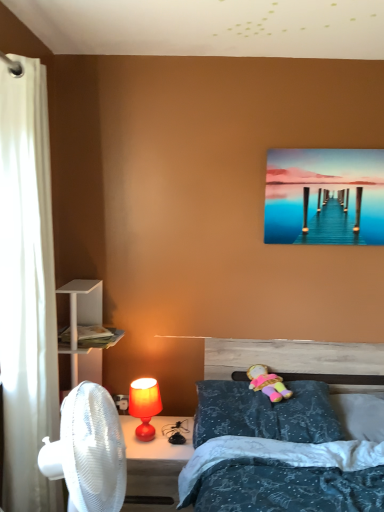
The image size is (384, 512). What do you see at coordinates (154, 463) in the screenshot? I see `matte red lamp at lower center` at bounding box center [154, 463].

Image resolution: width=384 pixels, height=512 pixels. What do you see at coordinates (144, 405) in the screenshot?
I see `matte orange lamp at lower left` at bounding box center [144, 405].

You are a GUI agent. You are given a task and a screenshot of the screen. Output one action in this format:
    pyautogui.click(x=<x>, y=<y>)
    Task: Click on the metallic glossy pier at upper right
    The image size is (384, 512).
    Given the screenshot: What is the action you would take?
    pyautogui.click(x=324, y=196)

Locate an element on the screen. The image size is (384, 512). blue textured pillow at lower right, which appears as the second pillow when viewed from the left is located at coordinates (360, 415).

Considering the relative positions of white fabric curtain at left and blue textured pillow at center, which is the second pillow from right to left, in the image provided, is white fabric curtain at left in front of blue textured pillow at center, which is the second pillow from right to left,?

Yes, white fabric curtain at left is in front of blue textured pillow at center, which is the second pillow from right to left.

Which point is more forward, [53,347] or [332,435]?

The point [53,347] is closer to the camera.

Is white fabric curtain at left thinner than blue textured pillow at center, which is the second pillow from right to left?

Indeed, white fabric curtain at left has a lesser width compared to blue textured pillow at center, which is the second pillow from right to left.

From the image's perspective, is white fabric curtain at left located above or below blue textured pillow at center, the 1th pillow in the left-to-right sequence?

white fabric curtain at left is above blue textured pillow at center, the 1th pillow in the left-to-right sequence.

Find the location of a particular element. This screenshot has height=512, width=384. lamp behind the matte red lamp at lower center is located at coordinates (144, 405).

In the image, is matte orange lamp at lower left on the left side or the right side of matte red lamp at lower center?

In the image, matte orange lamp at lower left appears on the left side of matte red lamp at lower center.

Is matte orange lamp at lower left not within matte red lamp at lower center?

Indeed, matte orange lamp at lower left is completely outside matte red lamp at lower center.

Does matte orange lamp at lower left have a larger size compared to matte red lamp at lower center?

No, matte orange lamp at lower left is not bigger than matte red lamp at lower center.

Is white fabric curtain at left placed right next to matte red lamp at lower center?

No, white fabric curtain at left is not next to matte red lamp at lower center.

Looking at this image, which of these two, white fabric curtain at left or matte red lamp at lower center, stands taller?

white fabric curtain at left.

Is white fabric curtain at left aimed at matte red lamp at lower center?

No, white fabric curtain at left is not aimed at matte red lamp at lower center.

Locate an element on the screen. The width and height of the screenshot is (384, 512). desk below the white fabric curtain at left (from a real-world perspective) is located at coordinates (154, 463).

How many degrees apart are the facing directions of white fabric curtain at left and matte orange lamp at lower left?

89.1 degrees separate the facing orientations of white fabric curtain at left and matte orange lamp at lower left.

Is white fabric curtain at left located outside matte orange lamp at lower left?

white fabric curtain at left is positioned outside matte orange lamp at lower left.

In the scene shown: Is white fabric curtain at left oriented towards matte orange lamp at lower left?

No, white fabric curtain at left is not turned towards matte orange lamp at lower left.

In the image, is white fabric curtain at left on the left side or the right side of matte orange lamp at lower left?

From the image, it's evident that white fabric curtain at left is to the left of matte orange lamp at lower left.

Is the surface of white fabric curtain at left in direct contact with blue textured pillow at lower right, which appears as the second pillow when viewed from the left?

white fabric curtain at left and blue textured pillow at lower right, which appears as the second pillow when viewed from the left, are not in contact.

Can you confirm if white fabric curtain at left is taller than blue textured pillow at lower right, which appears as the second pillow when viewed from the left?

Yes.

Considering the relative positions of white fabric curtain at left and blue textured pillow at lower right, which appears as the second pillow when viewed from the left, in the image provided, is white fabric curtain at left in front of blue textured pillow at lower right, which appears as the second pillow when viewed from the left,?

Yes, it is.

Can you confirm if blue textured pillow at center, which is the second pillow from right to left, is shorter than white fabric curtain at left?

Yes, blue textured pillow at center, which is the second pillow from right to left, is shorter than white fabric curtain at left.

Does blue textured pillow at center, which is the second pillow from right to left, touch white fabric curtain at left?

No, blue textured pillow at center, which is the second pillow from right to left, is not with white fabric curtain at left.

Is point (205, 432) more distant than point (39, 489)?

Yes, point (205, 432) is behind point (39, 489).

Which object is positioned more to the right, blue textured pillow at center, the 1th pillow in the left-to-right sequence, or white fabric curtain at left?

Positioned to the right is blue textured pillow at center, the 1th pillow in the left-to-right sequence.

Is plush fabric doll at center with matte orange lamp at lower left?

They are not placed beside each other.

Is the position of plush fabric doll at center less distant than that of matte orange lamp at lower left?

No, the depth of plush fabric doll at center is greater than that of matte orange lamp at lower left.

Where is `toy above the matte orange lamp at lower left (from a real-world perspective)`? Image resolution: width=384 pixels, height=512 pixels. toy above the matte orange lamp at lower left (from a real-world perspective) is located at coordinates (268, 383).

Identify the location of curtain that appears in front of the blue textured pillow at center, which is the second pillow from right to left. This screenshot has width=384, height=512. (27, 290).

The height and width of the screenshot is (512, 384). Identify the location of lamp behind the matte red lamp at lower center. (144, 405).

From the image, which object appears to be farther from metallic glossy pier at upper right, plush fabric doll at center or matte orange lamp at lower left?

Based on the image, matte orange lamp at lower left appears to be further to metallic glossy pier at upper right.

When comparing their distances from matte orange lamp at lower left, does metallic glossy pier at upper right or matte red lamp at lower center seem further?

metallic glossy pier at upper right lies further to matte orange lamp at lower left than the other object.

Considering their positions, is matte red lamp at lower center positioned closer to metallic glossy pier at upper right than matte orange lamp at lower left?

matte orange lamp at lower left is closer to metallic glossy pier at upper right.

Based on the photo, when comparing their distances from blue textured pillow at lower right, which appears as the second pillow when viewed from the left, does matte red lamp at lower center or plush fabric doll at center seem closer?

Based on the image, plush fabric doll at center appears to be nearer to blue textured pillow at lower right, which appears as the second pillow when viewed from the left.

Considering their positions, is metallic glossy pier at upper right positioned closer to matte orange lamp at lower left than blue textured pillow at center, the 1th pillow in the left-to-right sequence?

The object closer to matte orange lamp at lower left is blue textured pillow at center, the 1th pillow in the left-to-right sequence.

When comparing their distances from plush fabric doll at center, does white fabric curtain at left or metallic glossy pier at upper right seem further?

Based on the image, white fabric curtain at left appears to be further to plush fabric doll at center.

Considering their positions, is white fabric curtain at left positioned closer to blue textured pillow at lower right, the first pillow in the right-to-left sequence, than plush fabric doll at center?

plush fabric doll at center is positioned closer to the anchor blue textured pillow at lower right, the first pillow in the right-to-left sequence.

Based on their spatial positions, is plush fabric doll at center or blue textured pillow at center, which is the second pillow from right to left, closer to matte red lamp at lower center?

blue textured pillow at center, which is the second pillow from right to left, is closer to matte red lamp at lower center.

The width and height of the screenshot is (384, 512). What are the coordinates of `lamp between white fabric curtain at left and matte red lamp at lower center from top to bottom` in the screenshot? It's located at (144, 405).

This screenshot has width=384, height=512. What are the coordinates of `toy between metallic glossy pier at upper right and matte red lamp at lower center in the vertical direction` in the screenshot? It's located at (268, 383).

This screenshot has width=384, height=512. Identify the location of toy between white fabric curtain at left and metallic glossy pier at upper right from left to right. (268, 383).

This screenshot has width=384, height=512. In order to click on lamp between white fabric curtain at left and metallic glossy pier at upper right from left to right in this screenshot , I will do `click(144, 405)`.